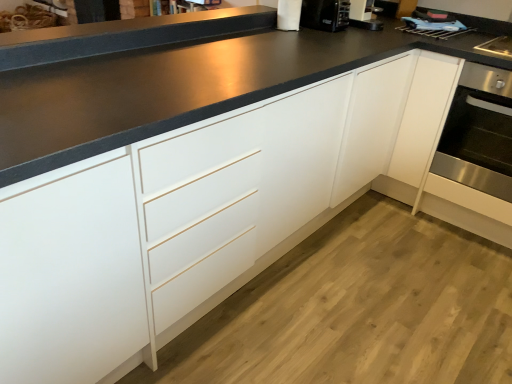
This screenshot has width=512, height=384. Find the location of `vacant area to the right of white paper towel at upper center`. vacant area to the right of white paper towel at upper center is located at coordinates (316, 36).